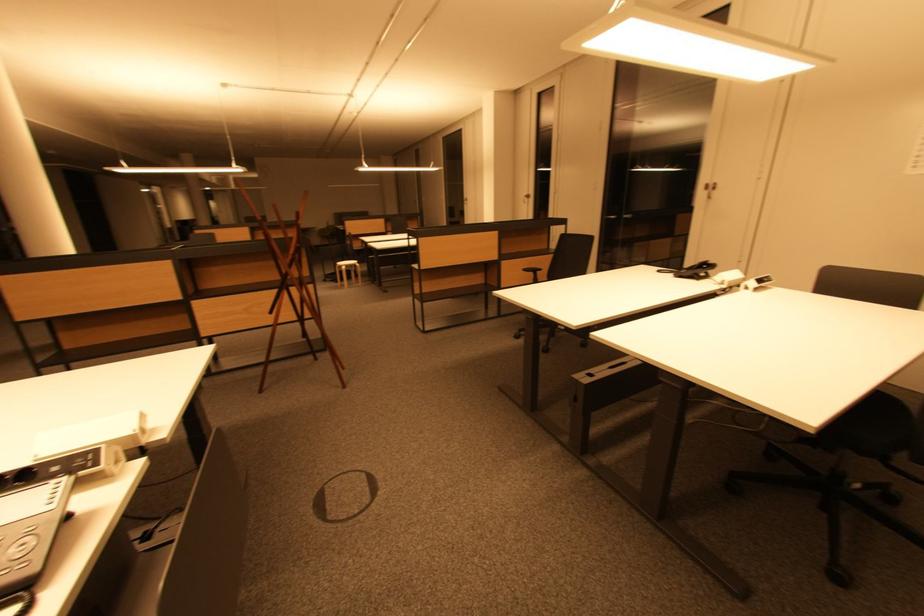
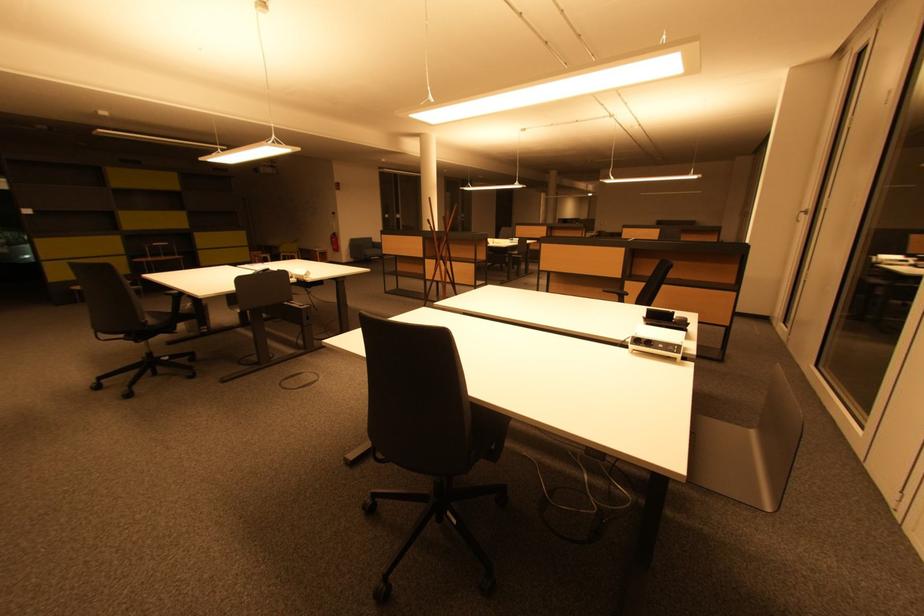
Locate, in the second image, the point that corresponds to (529,197) in the first image.

(808, 212)